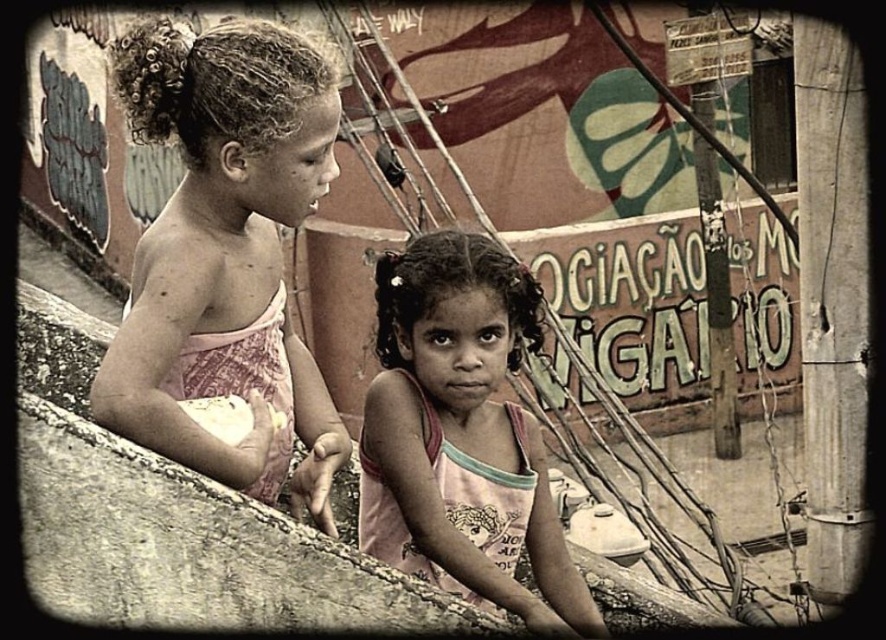
Question: Does pink fabric dress at upper left appear over pink fabric shirt at center?

Choices:
 (A) yes
 (B) no

Answer: (A)

Question: Can you confirm if pink fabric dress at upper left is positioned above pink fabric shirt at center?

Choices:
 (A) yes
 (B) no

Answer: (A)

Question: Does pink fabric dress at upper left have a larger size compared to pink fabric shirt at center?

Choices:
 (A) yes
 (B) no

Answer: (A)